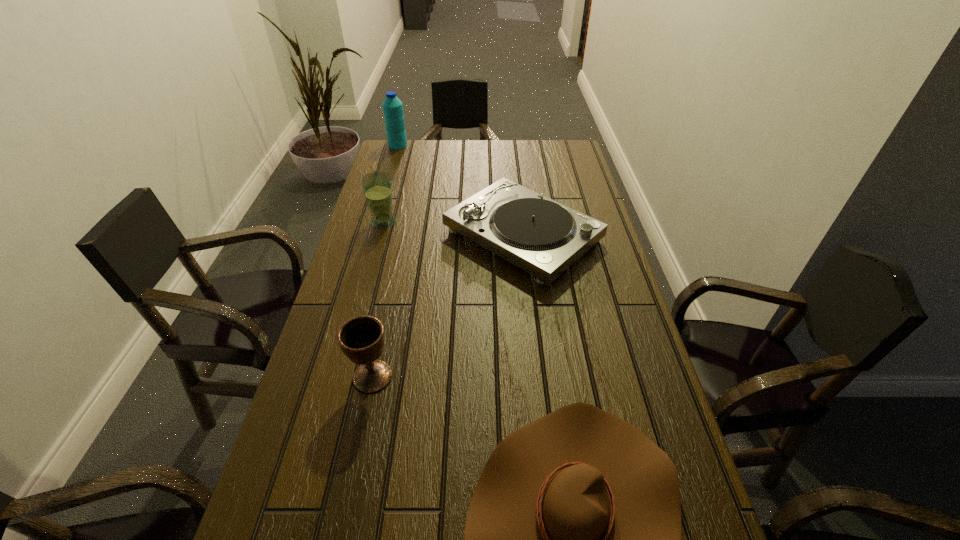
The height and width of the screenshot is (540, 960). In order to click on water bottle that is at the left edge in this screenshot , I will do `click(392, 107)`.

Locate an element on the screen. glass positioned at the left edge is located at coordinates (377, 186).

At what (x,y) coordinates should I click in order to perform the action: click on chalice situated at the left edge. Please return your answer as a coordinate pair (x, y). The image size is (960, 540). Looking at the image, I should click on tap(361, 339).

What are the coordinates of `object at the right edge` in the screenshot? It's located at (543, 237).

Locate an element on the screen. object that is at the far left corner is located at coordinates click(392, 107).

The image size is (960, 540). Find the location of `vacant space at the far edge`. vacant space at the far edge is located at coordinates (456, 161).

In the image, there is a desktop. What are the coordinates of `free region at the left edge` in the screenshot? It's located at (364, 260).

At what (x,y) coordinates should I click in order to perform the action: click on vacant space at the right edge of the desktop. Please return your answer as a coordinate pair (x, y). Looking at the image, I should click on (593, 333).

In the image, there is a desktop. Where is `free space at the far left corner`? Image resolution: width=960 pixels, height=540 pixels. free space at the far left corner is located at coordinates (400, 157).

At what (x,y) coordinates should I click in order to perform the action: click on unoccupied area between the chalice and the second shortest object. Please return your answer as a coordinate pair (x, y). Looking at the image, I should click on (447, 306).